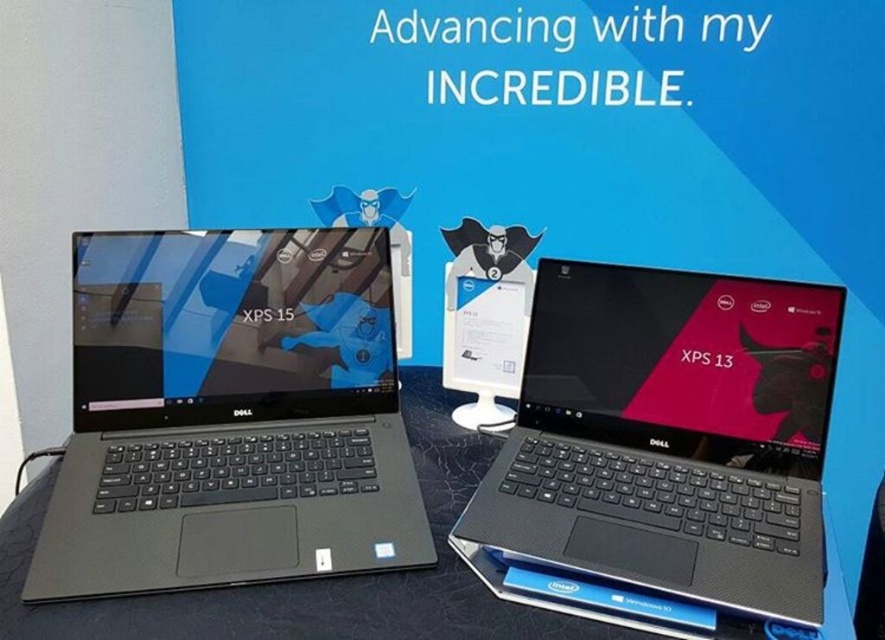
You are a delivery person trying to place two packages at specific coordinates on the image. The first package must be placed at point (x=175, y=426) and the second at point (x=4, y=579). However, you have a rule that packages cannot be placed in front of each other. Given the spatial relationship between these points, can you place both packages without violating the rule?

Point (x=175, y=426) is behind point (x=4, y=579), so placing the first package at point (x=175, y=426) and the second at point (x=4, y=579) will not violate the rule since the first is behind the second and thus not blocking it.

You are setting up a photography studio and need to place the matte black laptop at center on a stable surface. Can the black matte table at center support the laptop?

The matte black laptop at center is positioned over the black matte table at center, which means the table is already supporting the laptop.

You are a delivery person who needs to place the matte black laptop at left onto the black matte table at center. Based on the scene description, will the laptop fit on the table without overhanging the edges?

The matte black laptop at left is narrower than the black matte table at center, so it should fit without overhanging the edges.